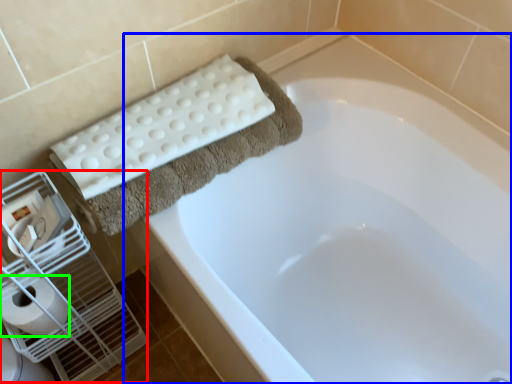
Question: Which is nearer to the bird cage (highlighted by a red box)? bathtub (highlighted by a blue box) or toilet paper (highlighted by a green box).

Choices:
 (A) bathtub
 (B) toilet paper

Answer: (B)